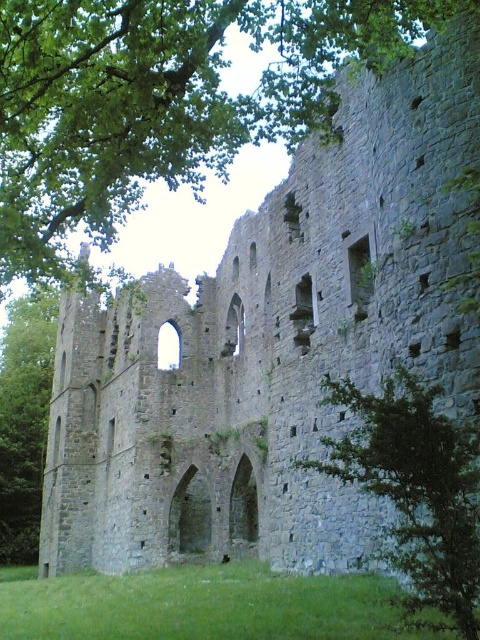
Question: Among these points, which one is farthest from the camera?

Choices:
 (A) (468, 513)
 (B) (45, 36)

Answer: (B)

Question: Is green leafy tree at upper center behind green leafy tree at lower right?

Choices:
 (A) no
 (B) yes

Answer: (B)

Question: Which point is closer to the camera?

Choices:
 (A) green leafy tree at lower right
 (B) green leafy tree at upper center

Answer: (A)

Question: Can you confirm if green leafy tree at upper center is thinner than green leafy tree at lower right?

Choices:
 (A) yes
 (B) no

Answer: (B)

Question: Is green leafy tree at upper center positioned behind green leafy tree at lower right?

Choices:
 (A) yes
 (B) no

Answer: (A)